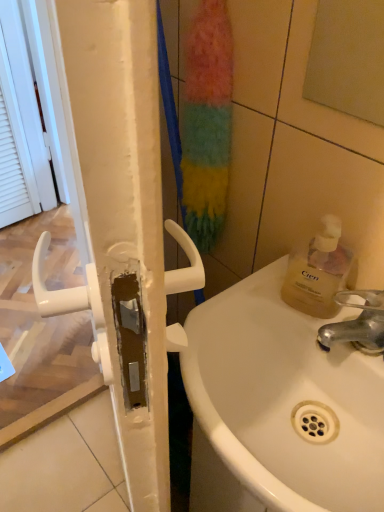
Question: Choose the correct answer: Is white plastic handle at left inside white glossy sink at center or outside it?

Choices:
 (A) outside
 (B) inside

Answer: (A)

Question: Considering the positions of point (110, 122) and point (317, 437), is point (110, 122) closer or farther from the camera than point (317, 437)?

Choices:
 (A) closer
 (B) farther

Answer: (A)

Question: Which object is the farthest from the silver metallic faucet at sink right?

Choices:
 (A) white plastic screen door at left
 (B) translucent yellow liquid at sink right
 (C) matte glass mirror at upper right
 (D) white plastic handle at left
 (E) white glossy sink at center

Answer: (A)

Question: Based on their relative distances, which object is farther from the translucent yellow liquid at sink right?

Choices:
 (A) silver metallic faucet at sink right
 (B) white glossy sink at center
 (C) matte glass mirror at upper right
 (D) white plastic handle at left
 (E) white plastic screen door at left

Answer: (E)